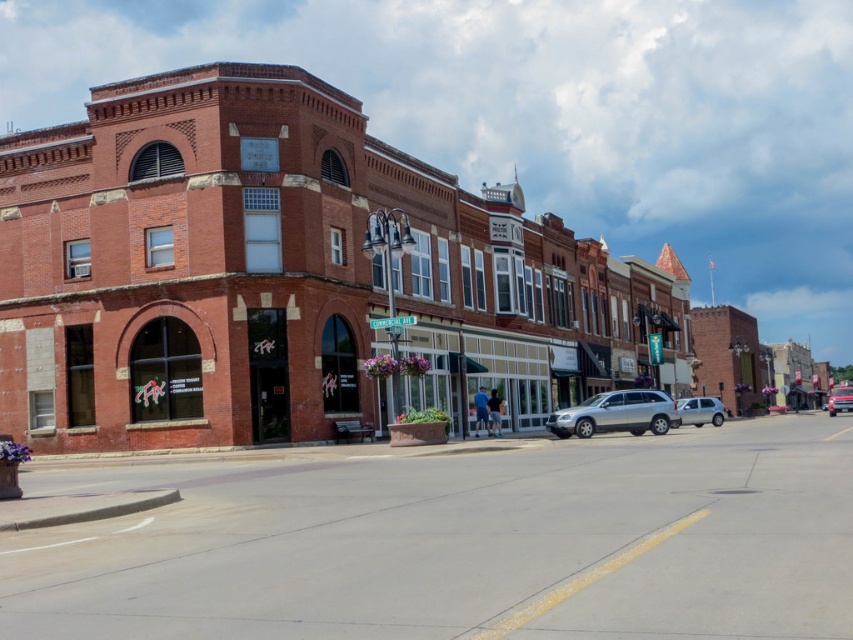
Can you confirm if satin silver suv at center-right is positioned above metallic silver suv at center?

Yes, satin silver suv at center-right is above metallic silver suv at center.

Image resolution: width=853 pixels, height=640 pixels. Find the location of `satin silver suv at center-right`. satin silver suv at center-right is located at coordinates (700, 410).

You are a GUI agent. You are given a task and a screenshot of the screen. Output one action in this format:
    pyautogui.click(x=<x>, y=<y>)
    Task: Click on the silver metallic suv at center
    
    Given the screenshot: What is the action you would take?
    pyautogui.click(x=616, y=413)

Does silver metallic suv at center have a greater height compared to metallic silver suv at center?

No, silver metallic suv at center is not taller than metallic silver suv at center.

Is point (621, 410) farther from viewer compared to point (842, 404)?

That is False.

At what (x,y) coordinates should I click in order to perform the action: click on silver metallic suv at center. Please return your answer as a coordinate pair (x, y). The height and width of the screenshot is (640, 853). Looking at the image, I should click on 616,413.

Is point (560, 420) positioned after point (718, 412)?

No, (560, 420) is closer to viewer.

Is silver metallic suv at center bigger than satin silver suv at center-right?

Correct, silver metallic suv at center is larger in size than satin silver suv at center-right.

Describe the element at coordinates (616, 413) in the screenshot. The height and width of the screenshot is (640, 853). I see `silver metallic suv at center` at that location.

The width and height of the screenshot is (853, 640). I want to click on silver metallic suv at center, so click(616, 413).